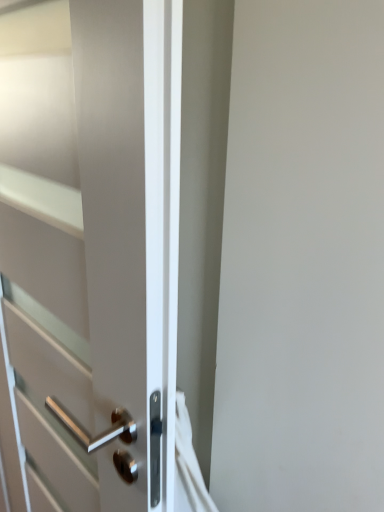
Measure the distance between point [165,466] and camera.

The distance of point [165,466] from camera is 25.94 inches.

I want to click on white glossy door handle at center, so pyautogui.click(x=90, y=253).

Image resolution: width=384 pixels, height=512 pixels. Describe the element at coordinates (90, 253) in the screenshot. I see `white glossy door handle at center` at that location.

Identify the location of white glossy door handle at center. (90, 253).